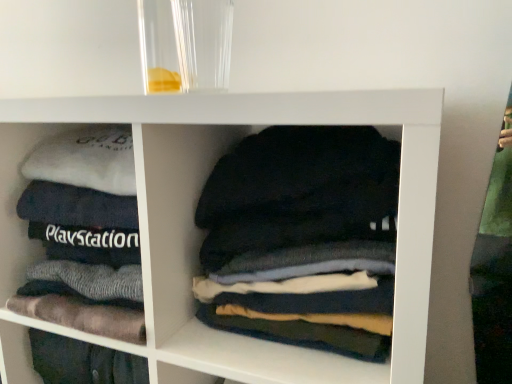
Question: Relative to dark gray cotton shirts at center, is white soft fabric at left in front or behind?

Choices:
 (A) front
 (B) behind

Answer: (B)

Question: Is white soft fabric at left to the left or to the right of dark gray cotton shirts at center in the image?

Choices:
 (A) left
 (B) right

Answer: (A)

Question: Considering the positions of white soft fabric at left and dark gray cotton shirts at center in the image, is white soft fabric at left taller or shorter than dark gray cotton shirts at center?

Choices:
 (A) short
 (B) tall

Answer: (B)

Question: From the image's perspective, is dark gray cotton shirts at center above or below white soft fabric at left?

Choices:
 (A) above
 (B) below

Answer: (B)

Question: From a real-world perspective, is dark gray cotton shirts at center above or below white soft fabric at left?

Choices:
 (A) above
 (B) below

Answer: (B)

Question: Is dark gray cotton shirts at center inside or outside of white soft fabric at left?

Choices:
 (A) inside
 (B) outside

Answer: (B)

Question: Considering their positions, is dark gray cotton shirts at center located in front of or behind white soft fabric at left?

Choices:
 (A) front
 (B) behind

Answer: (A)